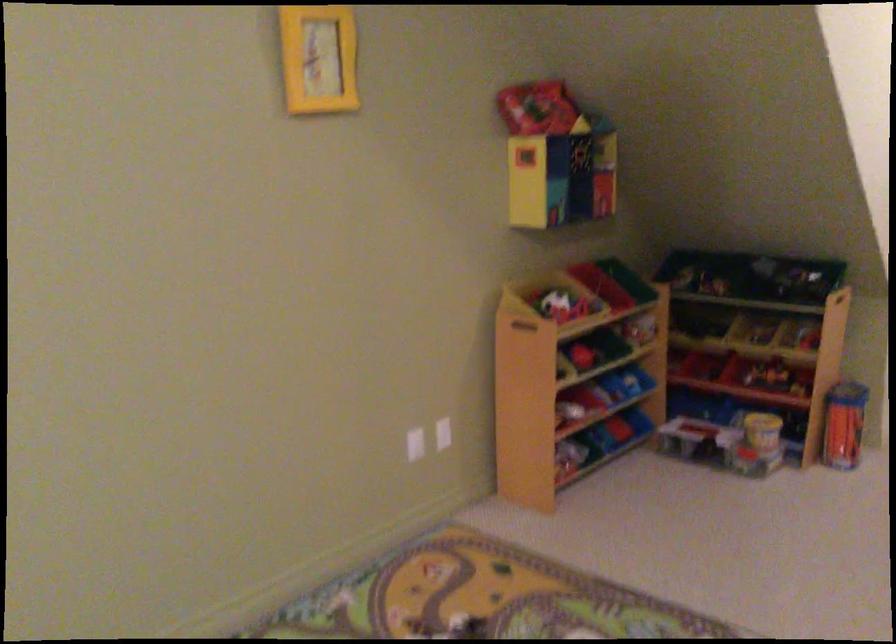
This screenshot has width=896, height=644. Find the location of `white toy ball`. white toy ball is located at coordinates click(x=571, y=410).